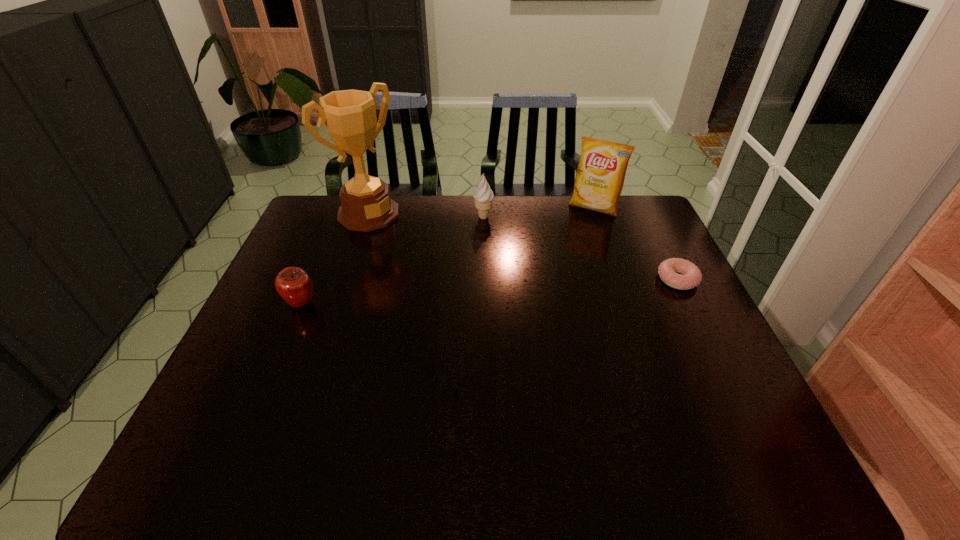
I want to click on free space on the desktop that is between the fourth tallest object and the rightmost object and is positioned on the front-facing side of the third object from left to right, so click(x=445, y=294).

In order to click on free space on the desktop that is between the fourth tallest object and the shortest object and is positioned on the front-facing side of the award in this screenshot , I will do `click(473, 292)`.

The width and height of the screenshot is (960, 540). Identify the location of free spot on the desktop that is between the fourth tallest object and the doughnut and is positioned on the front-facing side of the fourth shortest object. (550, 287).